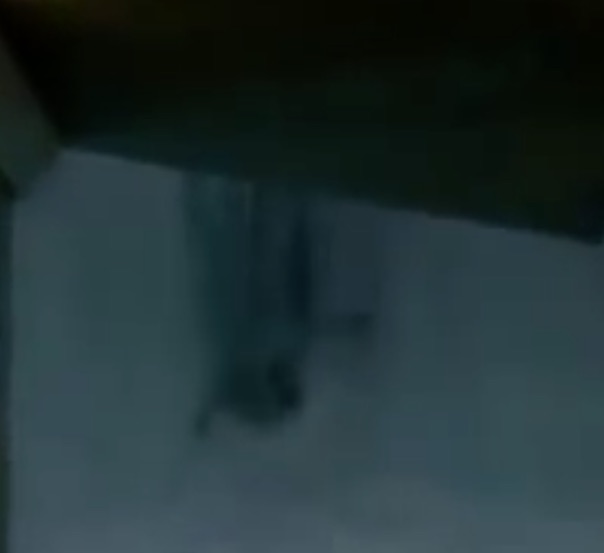
The height and width of the screenshot is (553, 604). Find the location of `corner`. corner is located at coordinates (63, 145).